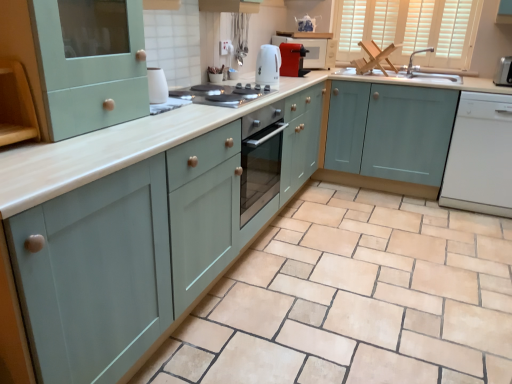
At what (x,y) coordinates should I click in order to perform the action: click on free location to the right of wooden shelf at left, placed as the 4th cabinetry when sorted from right to left. Please return your answer as a coordinate pair (x, y). The width and height of the screenshot is (512, 384). Looking at the image, I should click on (56, 149).